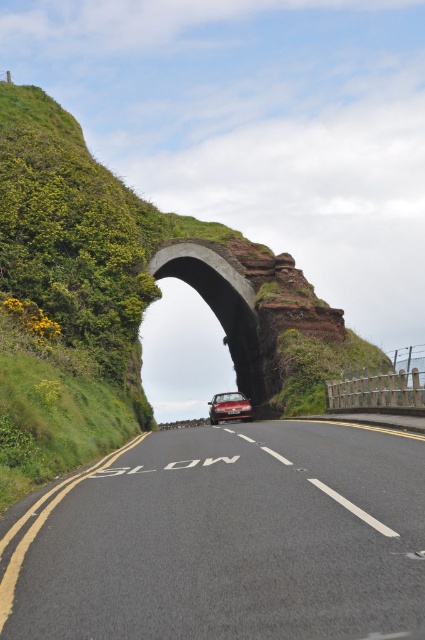
Who is shorter, concrete archway at center or shiny metallic car at center?

Standing shorter between the two is shiny metallic car at center.

Locate an element on the screen. The width and height of the screenshot is (425, 640). concrete archway at center is located at coordinates (218, 300).

Can you confirm if black asphalt road at center is positioned to the right of shiny metallic car at center?

Incorrect, black asphalt road at center is not on the right side of shiny metallic car at center.

How distant is black asphalt road at center from shiny metallic car at center?

They are 15.63 meters apart.

Does point (96, 556) come farther from viewer compared to point (232, 404)?

No, it is not.

The height and width of the screenshot is (640, 425). In order to click on black asphalt road at center in this screenshot , I will do `click(224, 538)`.

Is green grassy hillside at upper left below concrete archway at center?

Actually, green grassy hillside at upper left is above concrete archway at center.

Which is more to the right, green grassy hillside at upper left or concrete archway at center?

From the viewer's perspective, concrete archway at center appears more on the right side.

Is point (14, 349) in front of point (241, 388)?

That is True.

Where is `green grassy hillside at upper left`? The width and height of the screenshot is (425, 640). green grassy hillside at upper left is located at coordinates (119, 300).